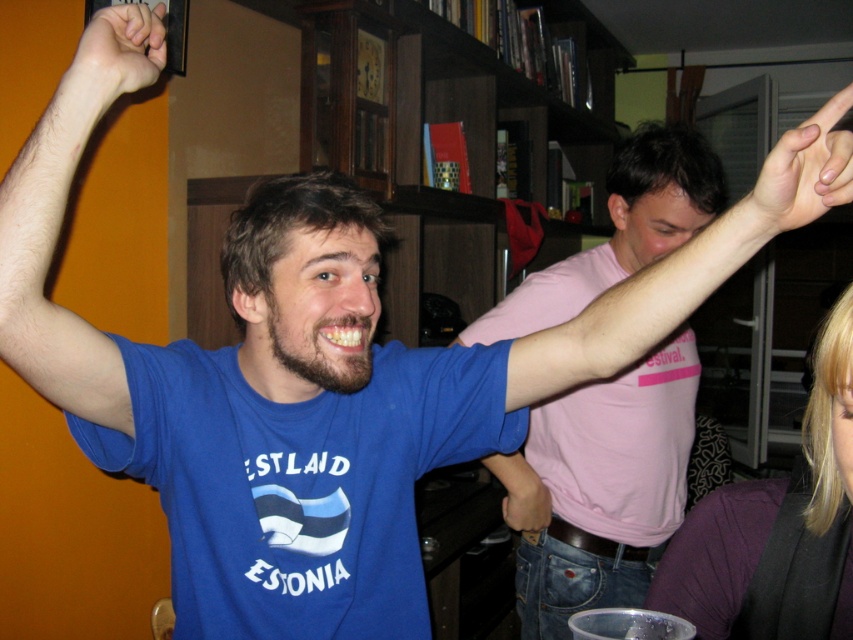
You are a photographer standing in the middle of the room. You want to take a photo that includes both the smooth skin hand at upper right and the smooth skin fist at upper left. Can you position yourself so that both objects are within your camera frame? Explain your reasoning.

The smooth skin hand at upper right and smooth skin fist at upper left are 12.49 feet apart. Since the photographer is standing in the middle of the room, they can position themselves to include both objects in the frame as they are within a reasonable distance apart.

Based on the scene described, which object is taller between the hairless skin at upper left and the smooth skin fist at upper left?

The hairless skin at upper left is taller than the smooth skin fist at upper left according to the description.

You are standing in the scene and want to place a small decorative item exactly at the location of the dark purple fabric at lower right. What coordinates should you use?

The coordinates for the dark purple fabric at lower right are at point (776,525).